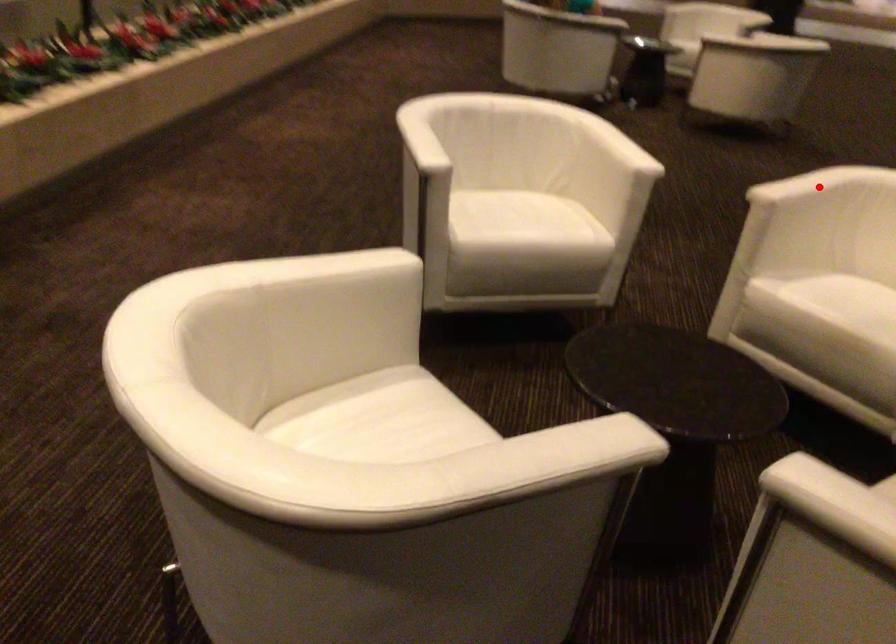
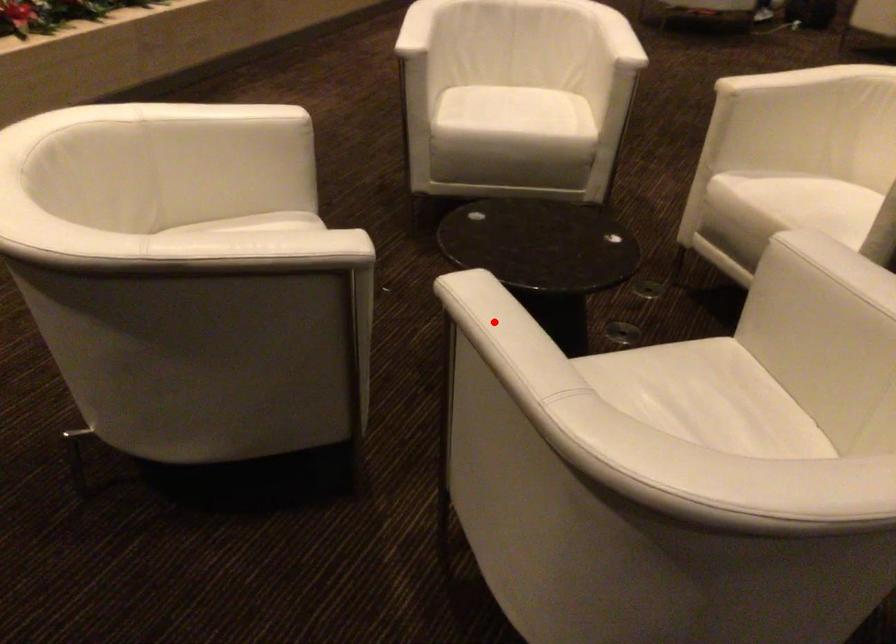
I am providing you with two images of the same scene from different viewpoints. A red point is marked on the first image and another point is marked on the second image. Does the point marked in image1 correspond to the same location as the one in image2?

No